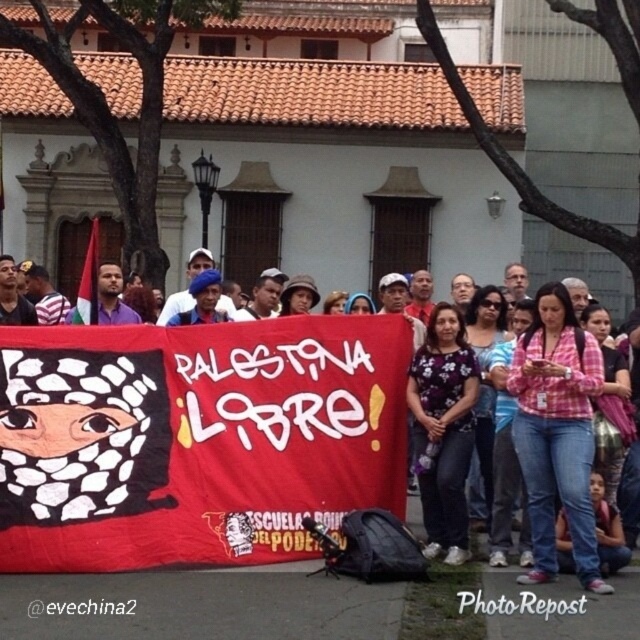
Who is more distant from viewer, (104,476) or (556,442)?

The point (104,476) is more distant.

Locate an element on the screen. The height and width of the screenshot is (640, 640). red fabric banner at center is located at coordinates [195, 440].

Locate an element on the screen. Image resolution: width=640 pixels, height=640 pixels. red fabric banner at center is located at coordinates (195, 440).

Is pink plaid shirt at center taller than red fabric banner at center?

Correct, pink plaid shirt at center is much taller as red fabric banner at center.

Can you confirm if pink plaid shirt at center is shorter than red fabric banner at center?

Incorrect, pink plaid shirt at center's height does not fall short of red fabric banner at center's.

Is point (246, 492) positioned in front of point (16, 515)?

No.

Find the location of a particular element. pink plaid shirt at center is located at coordinates (195, 440).

Does pink plaid shirt at center have a greater height compared to pink checkered shirt at center?

Yes, pink plaid shirt at center is taller than pink checkered shirt at center.

Is pink plaid shirt at center wider than pink checkered shirt at center?

Correct, the width of pink plaid shirt at center exceeds that of pink checkered shirt at center.

Between point (218, 556) and point (525, 394), which one is positioned behind?

The point (525, 394) is behind.

Find the location of `pink plaid shirt at center`. pink plaid shirt at center is located at coordinates (195, 440).